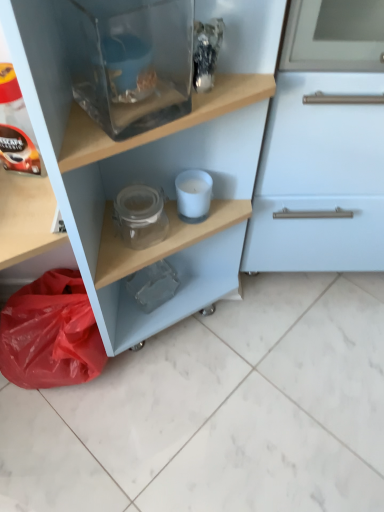
Question: Visually, is matte black coffee pod at left positioned to the left or to the right of red plastic bag at lower left?

Choices:
 (A) left
 (B) right

Answer: (B)

Question: Based on their sizes in the image, would you say matte black coffee pod at left is bigger or smaller than red plastic bag at lower left?

Choices:
 (A) big
 (B) small

Answer: (B)

Question: Considering the real-world distances, which object is farthest from the red plastic bag at lower left?

Choices:
 (A) white matte candle at center, acting as the second appliance starting from the top
 (B) transparent glass jar at upper center
 (C) matte black coffee pod at left
 (D) transparent glass fish tank at upper center, arranged as the 1th appliance when viewed from the top

Answer: (D)

Question: Which of these objects is positioned farthest from the transparent glass jar at upper center?

Choices:
 (A) red plastic bag at lower left
 (B) transparent glass fish tank at upper center, the 2th appliance from the back
 (C) matte black coffee pod at left
 (D) white matte candle at center, the first appliance positioned from the bottom

Answer: (C)